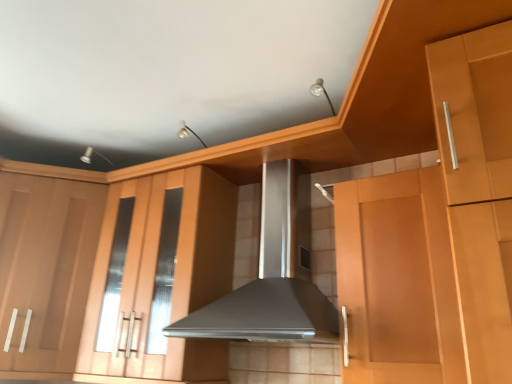
Question: From a real-world perspective, is matte wood cabinet at left, positioned as the 1th cabinetry in left-to-right order, below matte wood cabinet at center, which is the first cabinetry in right-to-left order?

Choices:
 (A) no
 (B) yes

Answer: (B)

Question: Is matte wood cabinet at left, positioned as the 1th cabinetry in left-to-right order, wider than matte wood cabinet at center, the second cabinetry positioned from the left?

Choices:
 (A) yes
 (B) no

Answer: (A)

Question: Considering the relative positions of matte wood cabinet at left, positioned as the 1th cabinetry in left-to-right order, and matte wood cabinet at center, which is the first cabinetry in right-to-left order, in the image provided, is matte wood cabinet at left, positioned as the 1th cabinetry in left-to-right order, to the left of matte wood cabinet at center, which is the first cabinetry in right-to-left order, from the viewer's perspective?

Choices:
 (A) yes
 (B) no

Answer: (A)

Question: Does matte wood cabinet at left, arranged as the second cabinetry when viewed from the right, come in front of matte wood cabinet at center, the second cabinetry positioned from the left?

Choices:
 (A) no
 (B) yes

Answer: (A)

Question: Does matte wood cabinet at left, positioned as the 1th cabinetry in left-to-right order, touch matte wood cabinet at center, the second cabinetry positioned from the left?

Choices:
 (A) yes
 (B) no

Answer: (B)

Question: From the image's perspective, relative to satin silver range hood at center, is matte wood cabinet at center, the second cabinetry positioned from the left, above or below?

Choices:
 (A) above
 (B) below

Answer: (B)

Question: From a real-world perspective, is matte wood cabinet at center, which is the first cabinetry in right-to-left order, above or below satin silver range hood at center?

Choices:
 (A) above
 (B) below

Answer: (B)

Question: Based on their positions, is matte wood cabinet at center, which is the first cabinetry in right-to-left order, located to the left or right of satin silver range hood at center?

Choices:
 (A) left
 (B) right

Answer: (A)

Question: Considering their positions, is matte wood cabinet at center, the second cabinetry positioned from the left, located in front of or behind satin silver range hood at center?

Choices:
 (A) behind
 (B) front

Answer: (A)

Question: Is matte wood cabinet at center, which is the first cabinetry in right-to-left order, taller or shorter than matte wood cabinet at left, positioned as the 1th cabinetry in left-to-right order?

Choices:
 (A) short
 (B) tall

Answer: (B)

Question: Does point (141, 177) appear closer or farther from the camera than point (77, 319)?

Choices:
 (A) farther
 (B) closer

Answer: (A)

Question: Is matte wood cabinet at center, the second cabinetry positioned from the left, in front of or behind matte wood cabinet at left, arranged as the second cabinetry when viewed from the right, in the image?

Choices:
 (A) behind
 (B) front

Answer: (B)

Question: Considering the positions of matte wood cabinet at center, which is the first cabinetry in right-to-left order, and matte wood cabinet at left, positioned as the 1th cabinetry in left-to-right order, in the image, is matte wood cabinet at center, which is the first cabinetry in right-to-left order, wider or thinner than matte wood cabinet at left, positioned as the 1th cabinetry in left-to-right order,?

Choices:
 (A) wide
 (B) thin

Answer: (B)

Question: Considering the positions of matte wood cabinet at left, arranged as the second cabinetry when viewed from the right, and matte wood cabinet at center, which is the first cabinetry in right-to-left order, in the image, is matte wood cabinet at left, arranged as the second cabinetry when viewed from the right, bigger or smaller than matte wood cabinet at center, which is the first cabinetry in right-to-left order,?

Choices:
 (A) small
 (B) big

Answer: (B)

Question: Is point (10, 203) positioned closer to the camera than point (189, 362)?

Choices:
 (A) farther
 (B) closer

Answer: (A)